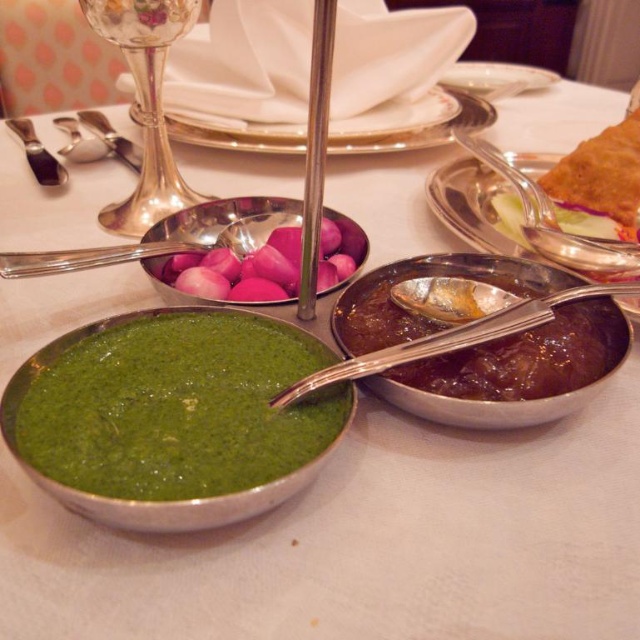
You are a photographer trying to capture a close shot of the green matte bowl at lower left. If your camera is positioned 7.94 inches away from the bowl, will you be able to focus clearly on it without moving the camera?

Yes, since the green matte bowl at lower left and camera are 7.94 inches apart, which is within the minimum focusing distance of most cameras, allowing for a clear close shot.

You are setting up a table and want to place a decorative plate between the green matte bowl at lower left and the shiny metal spoon at center. Considering their sizes, which object should the plate be closer to to ensure it fits properly?

The green matte bowl at lower left has a lesser width compared to the shiny metal spoon at center, so the decorative plate should be placed closer to the shiny metal spoon at center to accommodate its larger size.

You are a guest at a dinner party and want to take a photo of the pink glossy onion at center. The green matte bowl at lower left is blocking your view. Can you move the bowl to the side to get a clear shot?

The green matte bowl at lower left is bigger than pink glossy onion at center, so moving it might be necessary to avoid obstruction. However, since the bowl is larger, you might need to move it further away to ensure the onion is fully visible without any overlap.